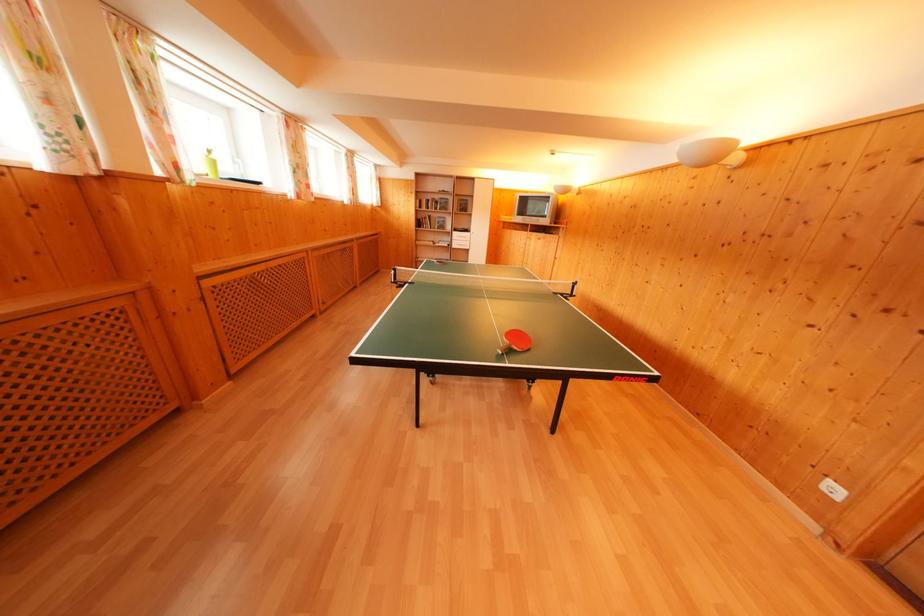
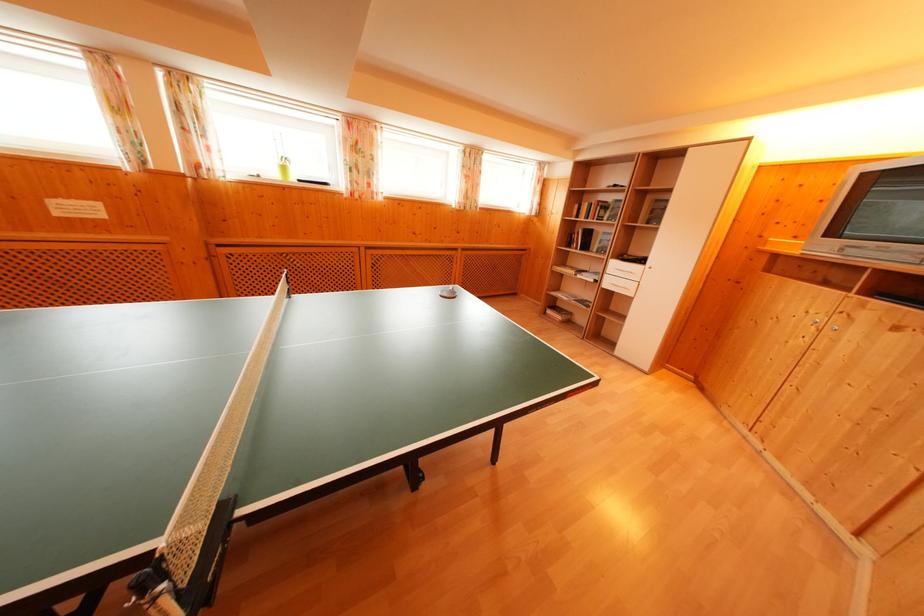
Locate, in the second image, the point that corresponds to (x=422, y=206) in the first image.

(581, 211)